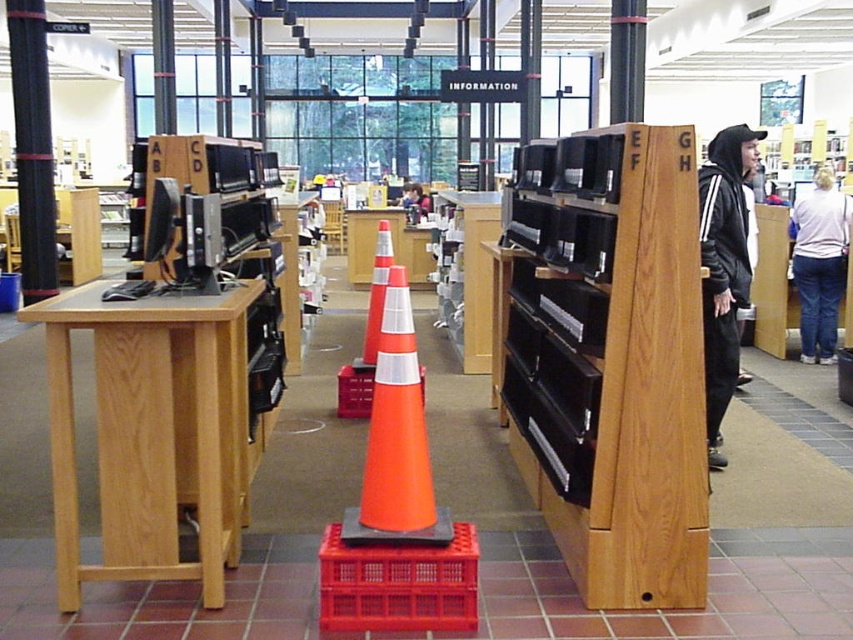
Which of these two, wooden bookshelf at center or matte orange cone at center, stands taller?

wooden bookshelf at center

Between wooden bookshelf at center and matte orange cone at center, which one has less height?

Standing shorter between the two is matte orange cone at center.

Between point (573, 147) and point (428, 556), which one is positioned behind?

Point (573, 147)

Find the location of a particular element. wooden bookshelf at center is located at coordinates (610, 358).

Who is higher up, matte orange cone at center or smooth skin face at center?

smooth skin face at center is higher up.

Is matte orange cone at center to the left of smooth skin face at center from the viewer's perspective?

No, matte orange cone at center is not to the left of smooth skin face at center.

Locate an element on the screen. The width and height of the screenshot is (853, 640). matte orange cone at center is located at coordinates (398, 582).

Find the location of a particular element. Image resolution: width=853 pixels, height=640 pixels. matte orange cone at center is located at coordinates (398, 582).

Consider the image. Between white cotton shirt at upper right and orange plastic traffic cone at center, which one appears on the right side from the viewer's perspective?

Positioned to the right is white cotton shirt at upper right.

Which of these two, white cotton shirt at upper right or orange plastic traffic cone at center, stands shorter?

With less height is orange plastic traffic cone at center.

Is point (792, 253) closer to camera compared to point (384, 268)?

No, (792, 253) is further to viewer.

Locate an element on the screen. white cotton shirt at upper right is located at coordinates (819, 262).